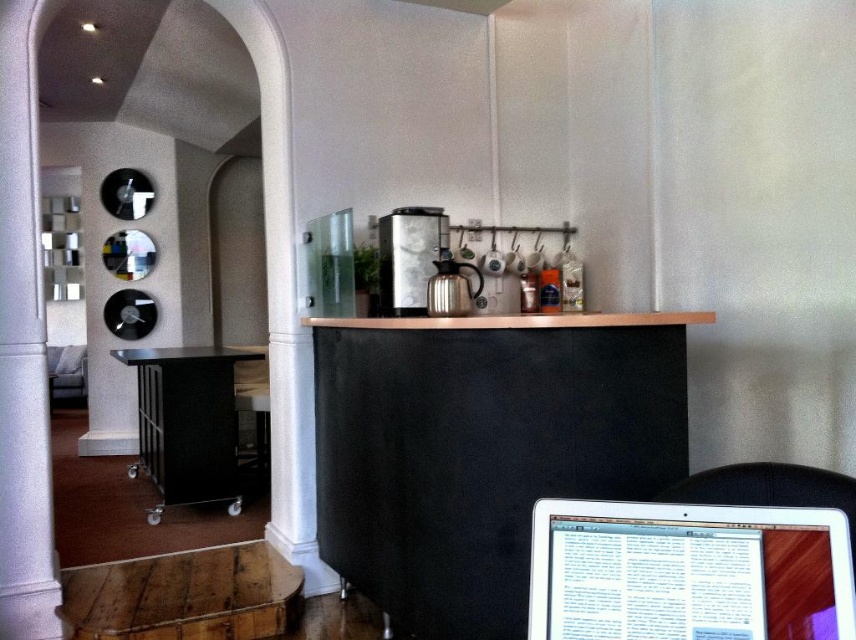
You are organizing a workspace and want to place the silver metallic laptop at lower right and the satin silver coffee machine at center on a shelf. Which object should you place first to ensure both fit on the shelf?

You should place the silver metallic laptop at lower right first since it occupies less space than the satin silver coffee machine at center, allowing enough room for both items on the shelf.

You are organizing a small event and need to place a decorative item on the table. Given the sizes of the black suede table at center and the white smooth pillar at left, which surface can accommodate a larger decorative item?

The black suede table at center is larger in size than the white smooth pillar at left, so it can accommodate a larger decorative item.